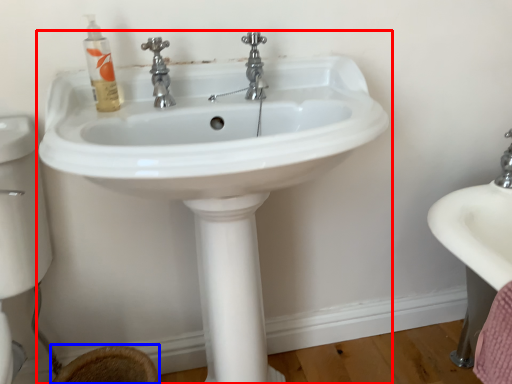
Question: Which object is further to the camera taking this photo, sink (highlighted by a red box) or toilet bowl (highlighted by a blue box)?

Choices:
 (A) sink
 (B) toilet bowl

Answer: (B)